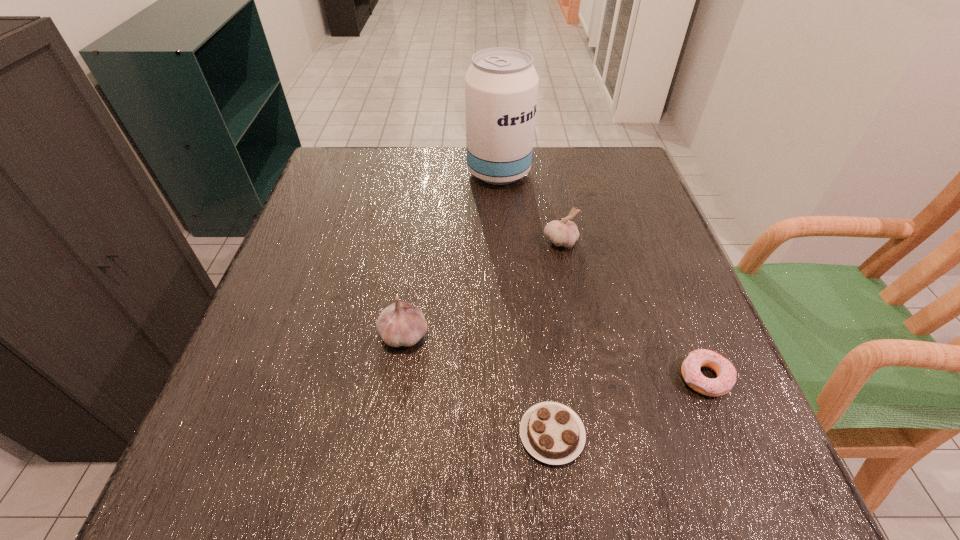
Where is `free spot located on the left of the nearer garlic`? This screenshot has width=960, height=540. free spot located on the left of the nearer garlic is located at coordinates (319, 334).

Find the location of a particular element. The width and height of the screenshot is (960, 540). vacant space located 0.150m on the right of the shorter garlic is located at coordinates (644, 241).

In order to click on vacant space positioned 0.320m on the left of the rightmost object in this screenshot , I will do `click(490, 378)`.

At what (x,y) coordinates should I click in order to perform the action: click on vacant space located 0.300m on the back of the chocolate cake. Please return your answer as a coordinate pair (x, y). Image resolution: width=960 pixels, height=540 pixels. Looking at the image, I should click on (533, 272).

The height and width of the screenshot is (540, 960). What are the coordinates of `object present at the far edge` in the screenshot? It's located at (501, 85).

Where is `object that is at the near edge`? object that is at the near edge is located at coordinates (551, 432).

Where is `object positioned at the right edge`? object positioned at the right edge is located at coordinates (726, 373).

You are a GUI agent. You are given a task and a screenshot of the screen. Output one action in this format:
    pyautogui.click(x=<x>, y=<y>)
    Task: Click on the vacant space at the far edge
    
    Given the screenshot: What is the action you would take?
    pyautogui.click(x=410, y=161)

You are a GUI agent. You are given a task and a screenshot of the screen. Output one action in this format:
    pyautogui.click(x=<x>, y=<y>)
    Task: Click on the vacant space at the near edge of the desktop
    
    Given the screenshot: What is the action you would take?
    pyautogui.click(x=593, y=484)

The height and width of the screenshot is (540, 960). Identify the location of blank area at the left edge. (x=348, y=235).